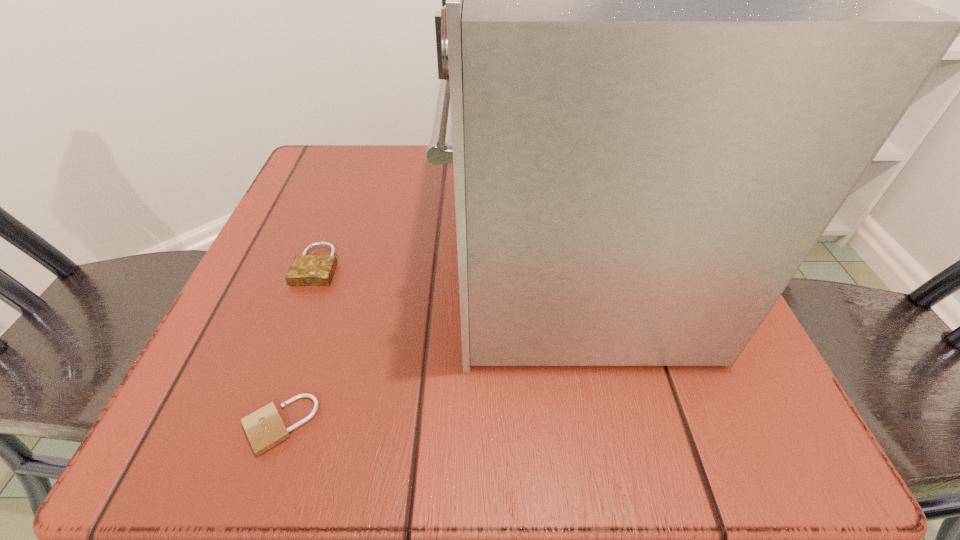
Find the location of a particular element. This screenshot has height=540, width=960. vacant area in the image that satisfies the following two spatial constraints: 1. on the front panel of the rightmost object; 2. on the keyhole side of the farther padlock is located at coordinates (566, 266).

The image size is (960, 540). What are the coordinates of `blank area in the image that satisfies the following two spatial constraints: 1. on the keyhole side of the shortest object; 2. on the left side of the farther padlock` in the screenshot? It's located at (257, 424).